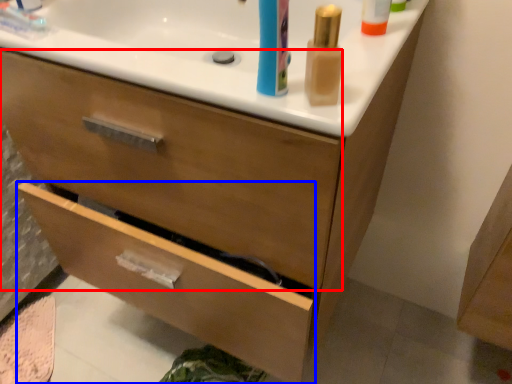
Question: Which of the following is the closest to the observer, drawer (highlighted by a red box) or drawer (highlighted by a blue box)?

Choices:
 (A) drawer
 (B) drawer

Answer: (A)